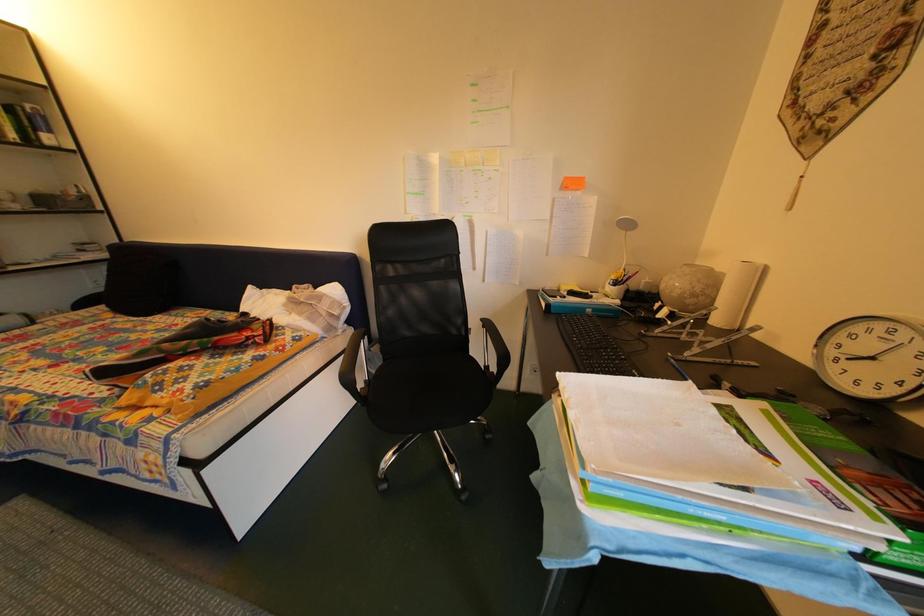
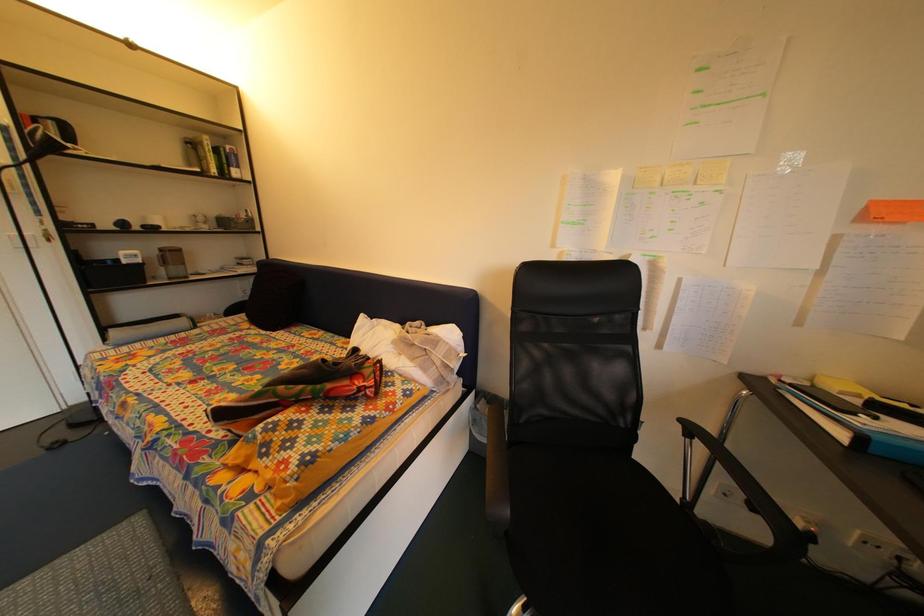
Which direction would the cameraman need to move to produce the second image?

The movement direction of the cameraman is left, forward.